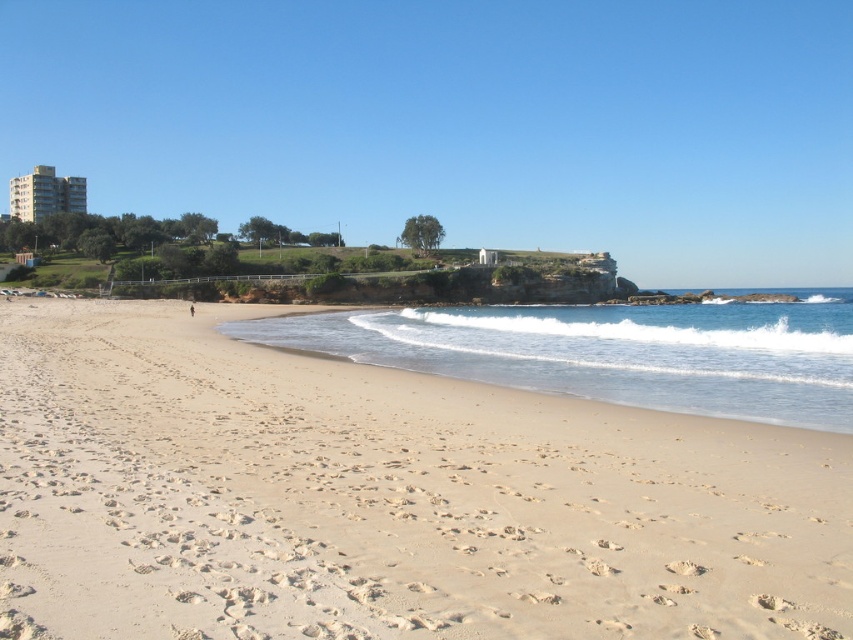
Question: Among these points, which one is nearest to the camera?

Choices:
 (A) (50, 417)
 (B) (775, 324)

Answer: (A)

Question: Is light beige sand at lower center to the left of clear blue water at lower right from the viewer's perspective?

Choices:
 (A) no
 (B) yes

Answer: (B)

Question: Does light beige sand at lower center have a greater width compared to clear blue water at lower right?

Choices:
 (A) yes
 (B) no

Answer: (B)

Question: Considering the relative positions of light beige sand at lower center and clear blue water at lower right in the image provided, where is light beige sand at lower center located with respect to clear blue water at lower right?

Choices:
 (A) left
 (B) right

Answer: (A)